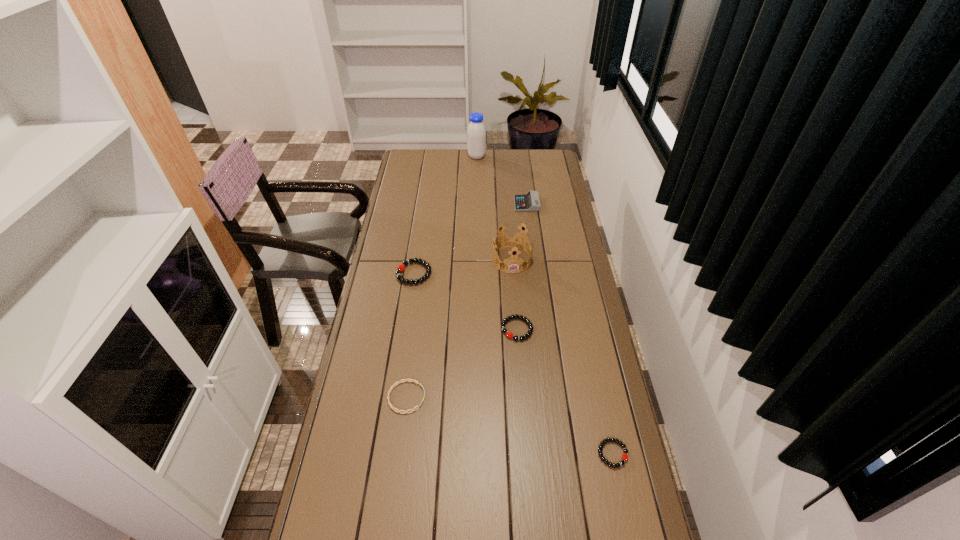
I want to click on object at the far edge, so click(476, 134).

Where is `calculator that is positioned at the right edge`? The height and width of the screenshot is (540, 960). calculator that is positioned at the right edge is located at coordinates (526, 202).

Locate an element on the screen. This screenshot has height=540, width=960. bracelet that is positioned at the right edge is located at coordinates (624, 458).

At what (x,y) coordinates should I click in order to perform the action: click on vacant area at the far edge. Please return your answer as a coordinate pair (x, y). The image size is (960, 540). Looking at the image, I should click on (458, 153).

I want to click on vacant space at the left edge of the desktop, so click(410, 221).

At what (x,y) coordinates should I click in order to perform the action: click on vacant space at the right edge of the desktop. Please return your answer as a coordinate pair (x, y). Looking at the image, I should click on (582, 284).

This screenshot has width=960, height=540. Find the location of `blank region between the second nearest bracelet and the nearest bracelet`. blank region between the second nearest bracelet and the nearest bracelet is located at coordinates (510, 426).

The height and width of the screenshot is (540, 960). Identify the location of unoccupied area between the nearest bracelet and the second tallest object. (563, 357).

The image size is (960, 540). I want to click on free spot between the sixth farthest object and the crown, so click(x=459, y=328).

This screenshot has width=960, height=540. Find the location of `free space that is in between the second nearest object and the fourth tallest object`. free space that is in between the second nearest object and the fourth tallest object is located at coordinates tap(410, 335).